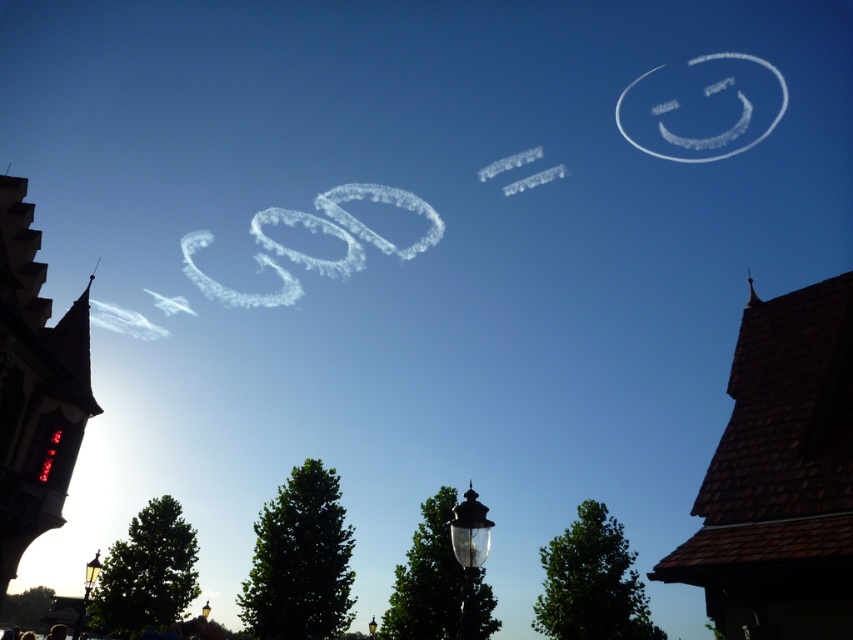
Consider the image. You are walking along a path in the evening and see a matte black lamp post at lower left and a glass lamp post at center. Which lamp post is closer to the left side of the path?

The matte black lamp post at lower left is positioned on the left side of the glass lamp post at center, so it is closer to the left side of the path.

You are a photographer positioned at the edge of the scene. You want to take a photo that includes both the matte black lamp post at lower left and the matte black lamp post at center without any obstruction. Is this possible?

The matte black lamp post at lower left is in front of the matte black lamp post at center, so taking a photo that includes both without obstruction is not possible as the lamp post at lower left would block the view of the one at center.